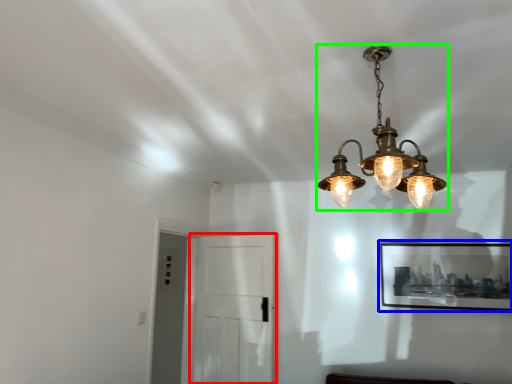
Question: Which object is positioned farthest from glass door (highlighted by a red box)? Select from picture frame (highlighted by a blue box) and lamp (highlighted by a green box).

Choices:
 (A) picture frame
 (B) lamp

Answer: (B)